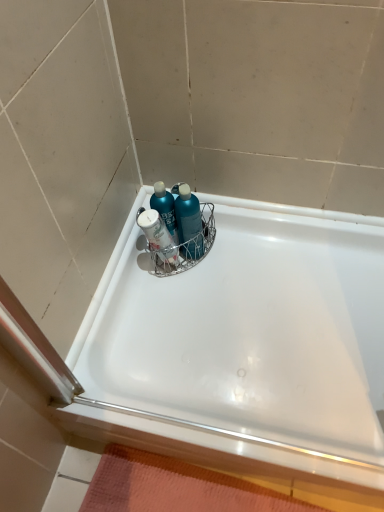
Question: From a real-world perspective, relative to teal glossy bottle at center, is white glossy ledge at lower right vertically above or below?

Choices:
 (A) above
 (B) below

Answer: (B)

Question: From the image's perspective, relative to teal glossy bottle at center, is white glossy ledge at lower right above or below?

Choices:
 (A) above
 (B) below

Answer: (B)

Question: Based on their relative distances, which object is farther from the teal glossy shampoo at center, placed as the 2th cleaning product when sorted from right to left?

Choices:
 (A) white glossy ledge at lower right
 (B) teal plastic bottles at center, the 2th cleaning product viewed from the left
 (C) teal glossy bottle at center
 (D) white glossy bathtub at upper center
 (E) orange textured bath mat at bottom

Answer: (E)

Question: Which is farther from the white glossy bathtub at upper center?

Choices:
 (A) white glossy ledge at lower right
 (B) teal glossy shampoo at center, placed as the 2th cleaning product when sorted from right to left
 (C) teal glossy bottle at center
 (D) teal plastic bottles at center, placed as the 1th cleaning product when sorted from right to left
 (E) orange textured bath mat at bottom

Answer: (B)